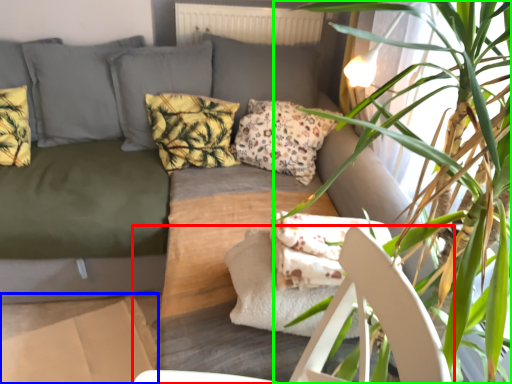
Question: Which object is positioned farthest from armchair (highlighted by a red box)? Select from cardboard box (highlighted by a blue box) and houseplant (highlighted by a green box).

Choices:
 (A) cardboard box
 (B) houseplant

Answer: (A)